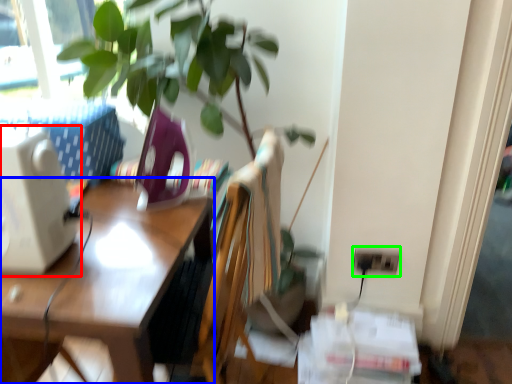
Question: Based on their relative distances, which object is farther from desktop computer (highlighted by a red box)? Choose from desk (highlighted by a blue box) and electric outlet (highlighted by a green box).

Choices:
 (A) desk
 (B) electric outlet

Answer: (B)